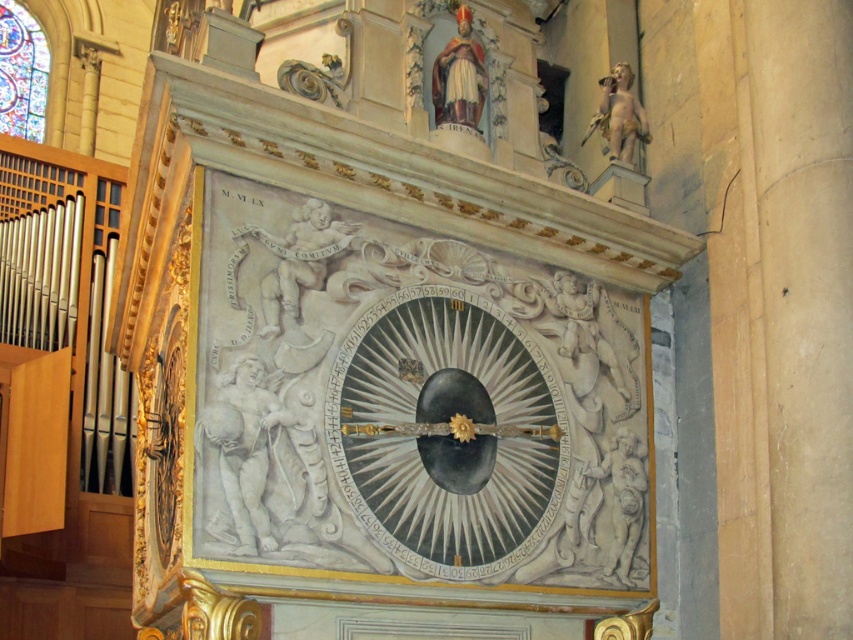
Does polychrome stone statue at upper center appear over white marble cherub at upper right?

Yes, polychrome stone statue at upper center is above white marble cherub at upper right.

Is point (469, 125) behind point (604, 93)?

No, it is not.

Which is behind, point (473, 58) or point (624, 141)?

Positioned behind is point (624, 141).

Identify the location of polychrome stone statue at upper center. The image size is (853, 640). (459, 76).

Identify the location of stained glass at upper left. [21, 72].

Image resolution: width=853 pixels, height=640 pixels. What do you see at coordinates (21, 72) in the screenshot?
I see `stained glass at upper left` at bounding box center [21, 72].

The image size is (853, 640). What are the coordinates of `stained glass at upper left` in the screenshot? It's located at (21, 72).

This screenshot has width=853, height=640. What do you see at coordinates (21, 72) in the screenshot?
I see `stained glass at upper left` at bounding box center [21, 72].

Is point (10, 32) in front of point (466, 97)?

No.

Is point (22, 22) less distant than point (468, 109)?

No.

You are a GUI agent. You are given a task and a screenshot of the screen. Output one action in this format:
    pyautogui.click(x=<x>, y=<y>)
    Task: Click on the stained glass at upper left
    This screenshot has width=853, height=640.
    Given the screenshot: What is the action you would take?
    pyautogui.click(x=21, y=72)